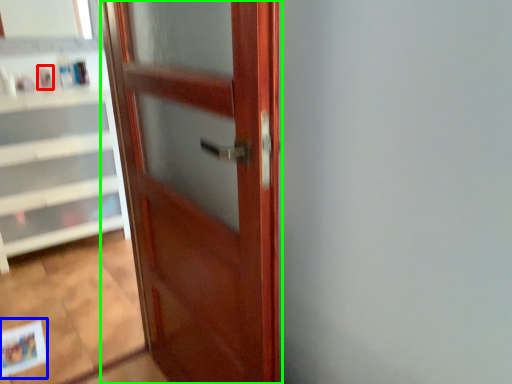
Question: Based on their relative distances, which object is farther from toiletry (highlighted by a red box)? Choose from postcard (highlighted by a blue box) and door (highlighted by a green box).

Choices:
 (A) postcard
 (B) door

Answer: (B)